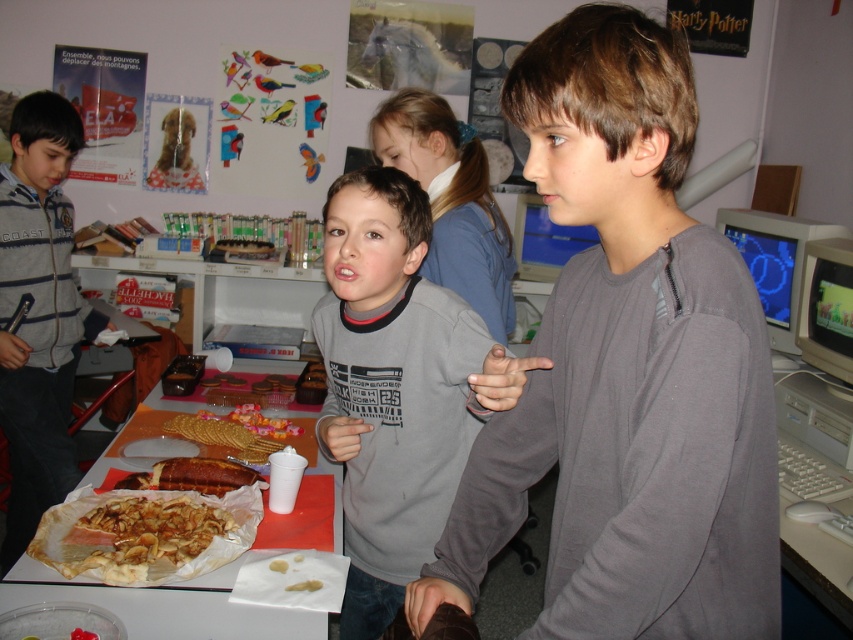
You are standing in the classroom and want to determine which of the two points, point [105,451] or point [165,460], is closer to you. Based on the description, which point is nearer?

Point [105,451] is further to the viewer than point [165,460]. Wait, no, the description says the opposite. Let me check again. The Objects Description states that point [105,451] is further to the viewer than point [165,460]. Hmm, so if point A is further than point B, then point B is closer to the viewer. Therefore, the answer should be point [165,460] is closer. But the question asks which is nearer, so the answer is point [165,460].

Consider the image. You are a student in the classroom and you want to reach the pink sugary cookies at center without touching the matte plastic tray at center. Is this possible?

The pink sugary cookies at center is in front of the matte plastic tray at center, so you can reach the pink sugary cookies at center without touching the matte plastic tray at center by accessing it from the front side.

You are a teacher in the classroom. You want to place both the golden flaky pastry at lower left and the pink sugary cookies at center onto a small plate that can only hold items up to 10 cm in width. Which item would you place first to ensure both fit?

The golden flaky pastry at lower left has a smaller width than the pink sugary cookies at center. Place the smaller pastry first, then the cookies to ensure both fit on the plate.